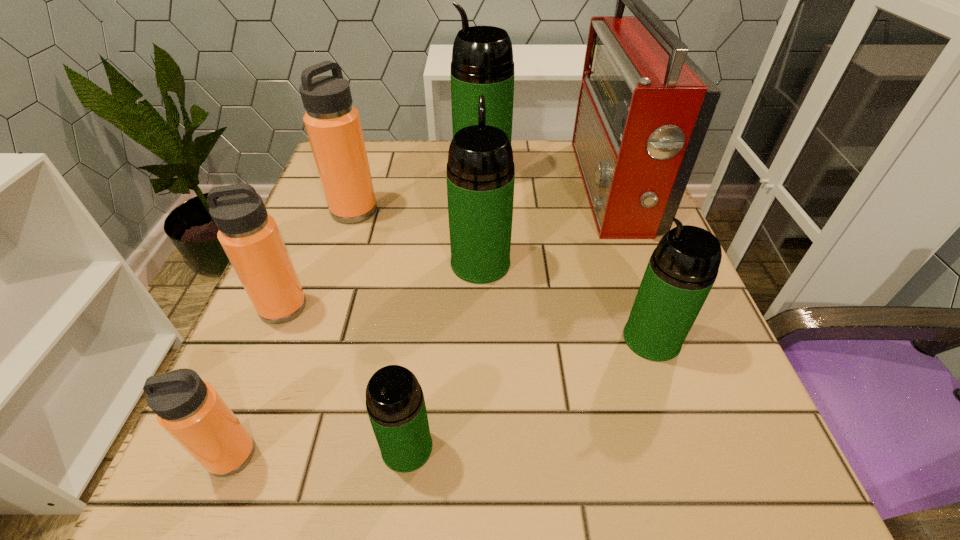
The height and width of the screenshot is (540, 960). What are the coordinates of `the nearest green thermos bottle` in the screenshot? It's located at (395, 403).

The width and height of the screenshot is (960, 540). I want to click on the smallest orange thermos bottle, so click(190, 410).

This screenshot has height=540, width=960. Identify the location of vacant space located from the spout of the farthest thermos bottle. (420, 173).

Identify the location of vacant space located from the spout of the farthest thermos bottle. (433, 173).

Identify the location of free space located 0.180m from the spout of the farthest thermos bottle. The image size is (960, 540). (378, 173).

Image resolution: width=960 pixels, height=540 pixels. I want to click on vacant space located 0.270m on the front-facing side of the radio receiver, so (460, 188).

This screenshot has width=960, height=540. In order to click on vacant space located 0.120m on the front-facing side of the radio receiver in this screenshot , I will do `click(526, 188)`.

The height and width of the screenshot is (540, 960). What are the coordinates of `free space located on the front-facing side of the radio receiver` in the screenshot? It's located at (447, 188).

Where is `free point located from the spout of the second biggest green thermos bottle`? The width and height of the screenshot is (960, 540). free point located from the spout of the second biggest green thermos bottle is located at coordinates (480, 222).

Image resolution: width=960 pixels, height=540 pixels. I want to click on free location located from the spout of the second biggest green thermos bottle, so [x=480, y=213].